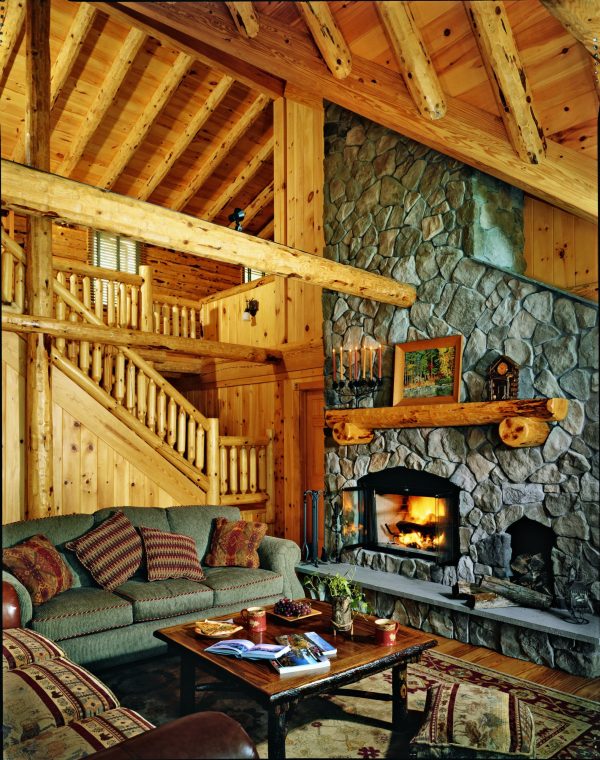
The image size is (600, 760). Find the location of `gray sofa arm`. gray sofa arm is located at coordinates coord(279,546).